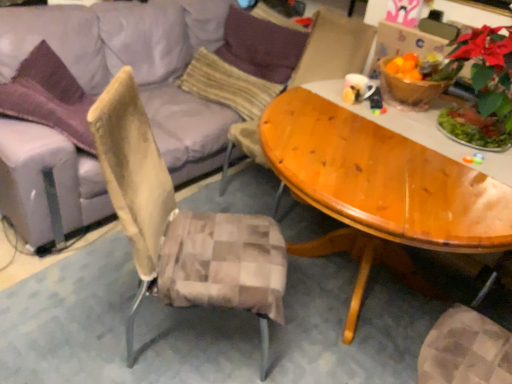
The image size is (512, 384). I want to click on beige textured pillow at center, positioned as the 2th pillow in top-to-bottom order, so click(228, 85).

The image size is (512, 384). What do you see at coordinates (261, 46) in the screenshot?
I see `purple fabric pillow at upper center, the 2th pillow from the bottom` at bounding box center [261, 46].

Identify the location of wooden chair at center. (334, 48).

At what (x,y) coordinates should I click in order to perform the action: click on light gray fabric couch at upper left. Please return your answer as a coordinate pair (x, y). This screenshot has height=384, width=512. Looking at the image, I should click on (137, 67).

In the scene shown: From a real-world perspective, relative to beige textured pillow at center, the first pillow ordered from the bottom, is purple fabric pillow at upper center, which ranks as the 1th pillow in top-to-bottom order, vertically above or below?

purple fabric pillow at upper center, which ranks as the 1th pillow in top-to-bottom order, is situated higher than beige textured pillow at center, the first pillow ordered from the bottom, in the real world.

Is purple fabric pillow at upper center, the 2th pillow from the bottom, bigger or smaller than beige textured pillow at center, the first pillow ordered from the bottom?

In the image, purple fabric pillow at upper center, the 2th pillow from the bottom, appears to be larger than beige textured pillow at center, the first pillow ordered from the bottom.

Is purple fabric pillow at upper center, the 2th pillow from the bottom, to the right of beige textured pillow at center, the first pillow ordered from the bottom, from the viewer's perspective?

Yes, purple fabric pillow at upper center, the 2th pillow from the bottom, is to the right of beige textured pillow at center, the first pillow ordered from the bottom.

Is purple fabric pillow at upper center, the 2th pillow from the bottom, in front of beige textured pillow at center, the first pillow ordered from the bottom?

No, the depth of purple fabric pillow at upper center, the 2th pillow from the bottom, is greater than that of beige textured pillow at center, the first pillow ordered from the bottom.

Can you confirm if beige textured pillow at center, the first pillow ordered from the bottom, is shorter than wooden chair at center?

Yes.

From the image's perspective, is beige textured pillow at center, the first pillow ordered from the bottom, located above or below wooden chair at center?

Clearly, from the image's perspective, beige textured pillow at center, the first pillow ordered from the bottom, is above wooden chair at center.

Does beige textured pillow at center, positioned as the 2th pillow in top-to-bottom order, have a lesser width compared to wooden chair at center?

Indeed, beige textured pillow at center, positioned as the 2th pillow in top-to-bottom order, has a lesser width compared to wooden chair at center.

From a real-world perspective, which object rests below the other?

beige textured pillow at center, positioned as the 2th pillow in top-to-bottom order, is physically lower.

Considering the positions of objects wooden chair at center and beige textured pillow at center, positioned as the 2th pillow in top-to-bottom order, in the image provided, who is more to the left, wooden chair at center or beige textured pillow at center, positioned as the 2th pillow in top-to-bottom order,?

Positioned to the left is beige textured pillow at center, positioned as the 2th pillow in top-to-bottom order.

Based on the photo, is beige textured pillow at center, the first pillow ordered from the bottom, a part of wooden chair at center?

That's incorrect, beige textured pillow at center, the first pillow ordered from the bottom, is not inside wooden chair at center.

Is wooden chair at center positioned far away from beige textured pillow at center, positioned as the 2th pillow in top-to-bottom order?

No.

How different are the orientations of wooden chair at center and beige textured pillow at center, positioned as the 2th pillow in top-to-bottom order, in degrees?

The facing directions of wooden chair at center and beige textured pillow at center, positioned as the 2th pillow in top-to-bottom order, are 8.33 degrees apart.

From the picture: Is green matte poinsettia at upper right completely or partially outside of light gray fabric couch at upper left?

green matte poinsettia at upper right lies outside light gray fabric couch at upper left's area.

Is green matte poinsettia at upper right aimed at light gray fabric couch at upper left?

No.

Based on the photo, are green matte poinsettia at upper right and light gray fabric couch at upper left beside each other?

No, green matte poinsettia at upper right is not beside light gray fabric couch at upper left.

How much distance is there between beige textured pillow at center, positioned as the 2th pillow in top-to-bottom order, and green matte poinsettia at upper right?

A distance of 1.26 meters exists between beige textured pillow at center, positioned as the 2th pillow in top-to-bottom order, and green matte poinsettia at upper right.

Is beige textured pillow at center, the first pillow ordered from the bottom, at the left side of green matte poinsettia at upper right?

Indeed, beige textured pillow at center, the first pillow ordered from the bottom, is positioned on the left side of green matte poinsettia at upper right.

Is beige textured pillow at center, positioned as the 2th pillow in top-to-bottom order, facing towards green matte poinsettia at upper right?

No, beige textured pillow at center, positioned as the 2th pillow in top-to-bottom order, is not facing towards green matte poinsettia at upper right.

Is beige textured pillow at center, the first pillow ordered from the bottom, placed right next to green matte poinsettia at upper right?

No, beige textured pillow at center, the first pillow ordered from the bottom, is not beside green matte poinsettia at upper right.

From the image's perspective, does light gray fabric couch at upper left appear lower than green matte poinsettia at upper right?

Correct, light gray fabric couch at upper left appears lower than green matte poinsettia at upper right in the image.

The width and height of the screenshot is (512, 384). I want to click on studio couch directly beneath the green matte poinsettia at upper right (from a real-world perspective), so click(x=137, y=67).

Is point (27, 196) positioned behind point (501, 44)?

Yes.

From their relative heights in the image, would you say light gray fabric couch at upper left is taller or shorter than green matte poinsettia at upper right?

Considering their sizes, light gray fabric couch at upper left has more height than green matte poinsettia at upper right.

From the image's perspective, which one is positioned higher, wooden chair at center or purple fabric pillow at upper center, the 2th pillow from the bottom?

purple fabric pillow at upper center, the 2th pillow from the bottom, appears higher in the image.

Is purple fabric pillow at upper center, the 2th pillow from the bottom, at the back of wooden chair at center?

No, wooden chair at center's orientation is not away from purple fabric pillow at upper center, the 2th pillow from the bottom.

There is a beige textured pillow at center, the first pillow ordered from the bottom. Find the location of `pillow above it (from a real-world perspective)`. pillow above it (from a real-world perspective) is located at coordinates (261, 46).

This screenshot has height=384, width=512. In the image, there is a beige textured pillow at center, the first pillow ordered from the bottom. What are the coordinates of `chair below it (from the image's perspective)` in the screenshot? It's located at (334, 48).

Based on their spatial positions, is beige textured pillow at center, the first pillow ordered from the bottom, or wooden chair at center further from purple fabric pillow at upper center, which ranks as the 1th pillow in top-to-bottom order?

Based on the image, wooden chair at center appears to be further to purple fabric pillow at upper center, which ranks as the 1th pillow in top-to-bottom order.

Estimate the real-world distances between objects in this image. Which object is further from wooden chair at center, beige textured pillow at center, the first pillow ordered from the bottom, or light gray fabric couch at upper left?

light gray fabric couch at upper left is further to wooden chair at center.

Which object lies nearer to the anchor point light gray fabric couch at upper left, green matte poinsettia at upper right or purple fabric pillow at upper center, the 2th pillow from the bottom?

purple fabric pillow at upper center, the 2th pillow from the bottom, is positioned closer to the anchor light gray fabric couch at upper left.

Considering their positions, is green matte poinsettia at upper right positioned further to light gray fabric couch at upper left than wooden chair at center?

green matte poinsettia at upper right is positioned further to the anchor light gray fabric couch at upper left.

When comparing their distances from beige textured pillow at center, positioned as the 2th pillow in top-to-bottom order, does green matte poinsettia at upper right or purple fabric pillow at upper center, which ranks as the 1th pillow in top-to-bottom order, seem further?

green matte poinsettia at upper right lies further to beige textured pillow at center, positioned as the 2th pillow in top-to-bottom order, than the other object.

From the image, which object appears to be nearer to green matte poinsettia at upper right, purple fabric pillow at upper center, which ranks as the 1th pillow in top-to-bottom order, or light gray fabric couch at upper left?

Based on the image, purple fabric pillow at upper center, which ranks as the 1th pillow in top-to-bottom order, appears to be nearer to green matte poinsettia at upper right.

Considering their positions, is green matte poinsettia at upper right positioned closer to purple fabric pillow at upper center, the 2th pillow from the bottom, than light gray fabric couch at upper left?

light gray fabric couch at upper left lies closer to purple fabric pillow at upper center, the 2th pillow from the bottom, than the other object.

When comparing their distances from light gray fabric couch at upper left, does green matte poinsettia at upper right or beige textured pillow at center, positioned as the 2th pillow in top-to-bottom order, seem further?

green matte poinsettia at upper right is positioned further to the anchor light gray fabric couch at upper left.

Image resolution: width=512 pixels, height=384 pixels. Identify the location of pillow between beige textured pillow at center, positioned as the 2th pillow in top-to-bottom order, and green matte poinsettia at upper right, in the horizontal direction. (261, 46).

Locate an element on the screen. The image size is (512, 384). pillow between light gray fabric couch at upper left and purple fabric pillow at upper center, which ranks as the 1th pillow in top-to-bottom order, along the z-axis is located at coordinates (228, 85).

The width and height of the screenshot is (512, 384). Identify the location of chair between purple fabric pillow at upper center, the 2th pillow from the bottom, and green matte poinsettia at upper right from left to right. (334, 48).

Find the location of a particular element. chair between beige textured pillow at center, the first pillow ordered from the bottom, and green matte poinsettia at upper right, in the horizontal direction is located at coordinates (334, 48).